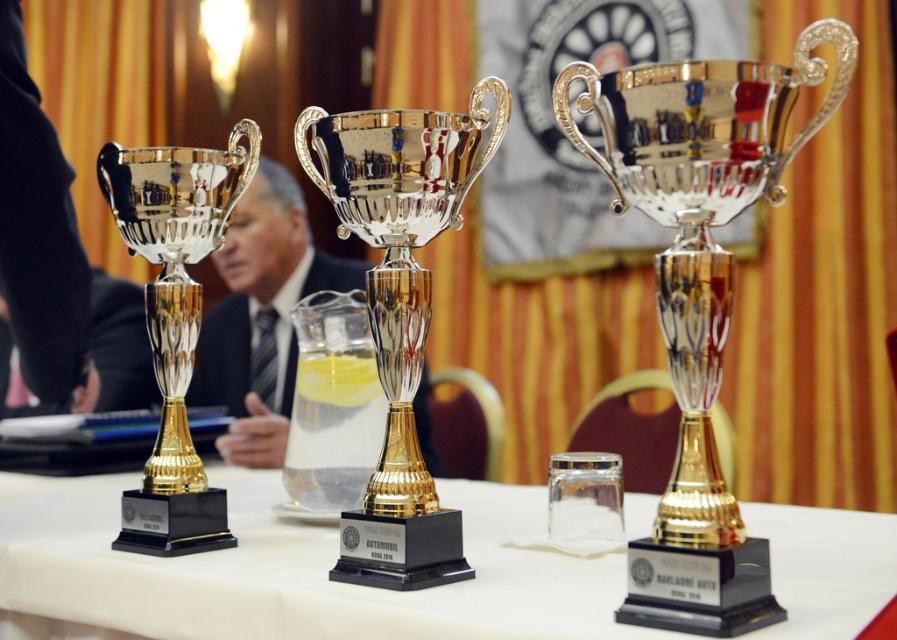
Does metallic trophies at center lie behind gold polished trophy at center?

No, metallic trophies at center is closer to the viewer.

Is metallic trophies at center above gold polished trophy at center?

No.

Between point (530, 630) and point (632, 147), which one is positioned behind?

The point (632, 147) is more distant.

Identify the location of metallic trophies at center. (292, 570).

Does polished silver trophy at left appear under polished metal trophy at center?

No.

Is polished silver trophy at left positioned at the back of polished metal trophy at center?

Yes, it is.

Which is in front, point (176, 166) or point (380, 417)?

Point (176, 166) is more forward.

Locate an element on the screen. This screenshot has width=897, height=640. polished silver trophy at left is located at coordinates (173, 321).

The image size is (897, 640). Describe the element at coordinates (292, 570) in the screenshot. I see `metallic trophies at center` at that location.

Is metallic trophies at center taller than polished metal trophy at center?

In fact, metallic trophies at center may be shorter than polished metal trophy at center.

Describe the element at coordinates (292, 570) in the screenshot. This screenshot has width=897, height=640. I see `metallic trophies at center` at that location.

This screenshot has height=640, width=897. Find the location of `metallic trophies at center`. metallic trophies at center is located at coordinates (292, 570).